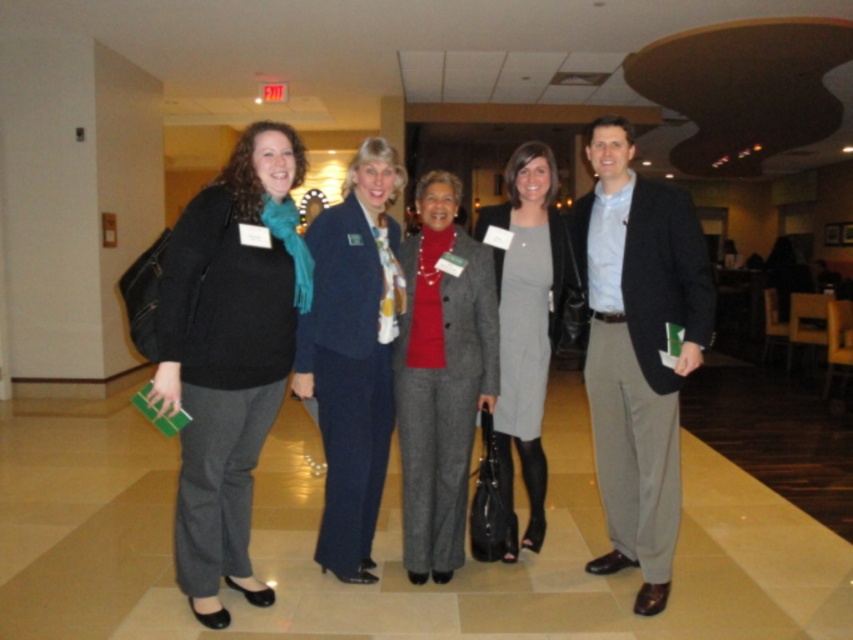
Question: Is matte black blazer at right below gray wool dress at center?

Choices:
 (A) no
 (B) yes

Answer: (B)

Question: Considering the real-world distances, which object is closest to the gray wool suit at center?

Choices:
 (A) gray wool dress at center
 (B) matte black blazer at right

Answer: (A)

Question: Which point is farther to the camera?

Choices:
 (A) gray wool suit at center
 (B) gray wool dress at center
 (C) matte black jacket at left
 (D) matte black blazer at right

Answer: (B)

Question: Is navy blue suit at center above gray wool suit at center?

Choices:
 (A) yes
 (B) no

Answer: (A)

Question: Can you confirm if matte black jacket at left is positioned below navy blue suit at center?

Choices:
 (A) yes
 (B) no

Answer: (A)

Question: Which of these objects is positioned closest to the matte black blazer at right?

Choices:
 (A) gray wool dress at center
 (B) navy blue suit at center
 (C) gray wool suit at center
 (D) matte black jacket at left

Answer: (A)